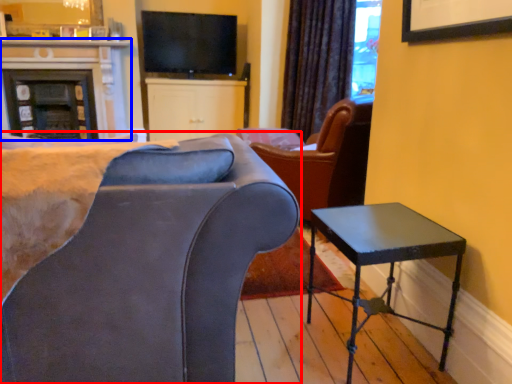
Question: Among these objects, which one is farthest to the camera, chair (highlighted by a red box) or fireplace (highlighted by a blue box)?

Choices:
 (A) chair
 (B) fireplace

Answer: (B)